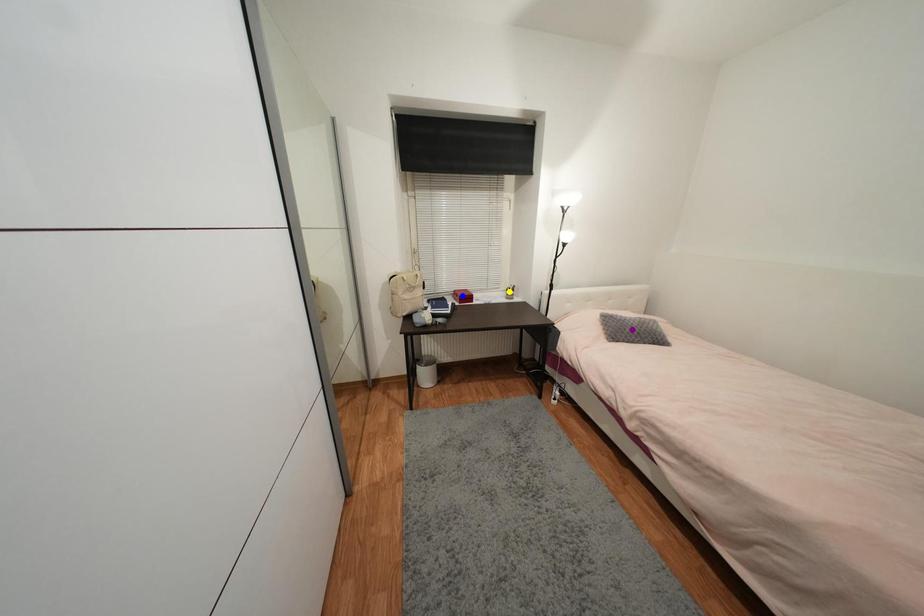
Order these from nearest to farthest:
- purple point
- yellow point
- blue point

1. purple point
2. blue point
3. yellow point